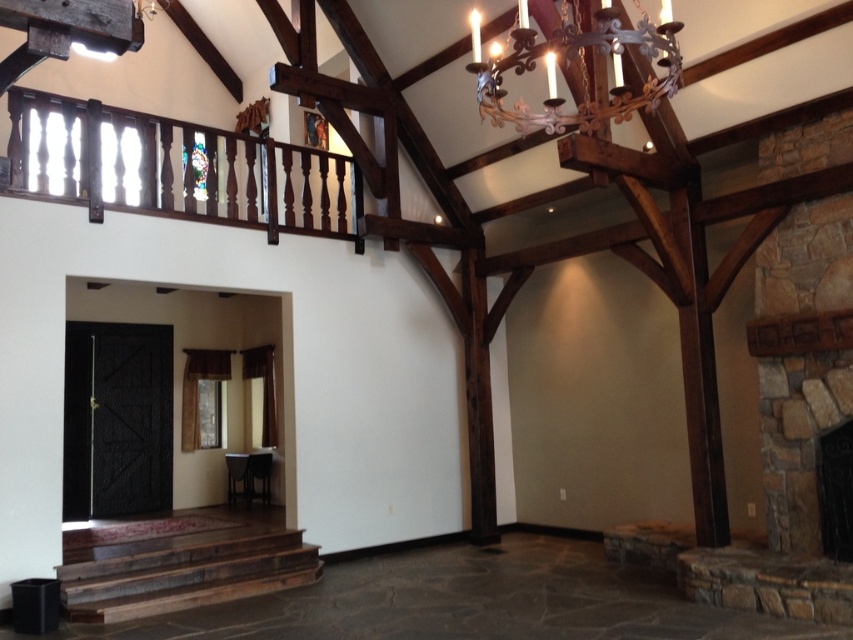
You are an interior designer assessing the room layout. You need to determine if the wrought iron chandelier at upper center is visible from the entrance located at the lower left corner. Based on their positions, can you see the chandelier through the dark wood balustrade at upper left?

The wrought iron chandelier at upper center is behind the dark wood balustrade at upper left, so it would be obstructed by the balustrade and not fully visible from the entrance at the lower left corner.

In the scene shown: You are a painter who needs to hang a 3.5 meter wide canvas between the dark wood balustrade at upper left and the dark stone fireplace at right. Is there enough space?

The dark wood balustrade at upper left is 5.67 meters away from the dark stone fireplace at right, so yes, there is enough space to hang a 3.5 meter wide canvas between them since the distance is greater than the canvas width.